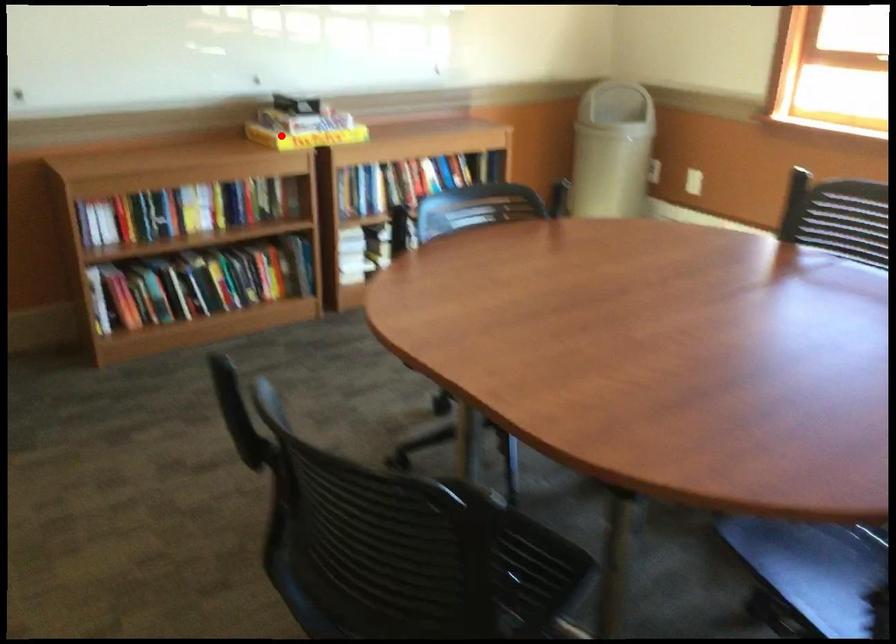
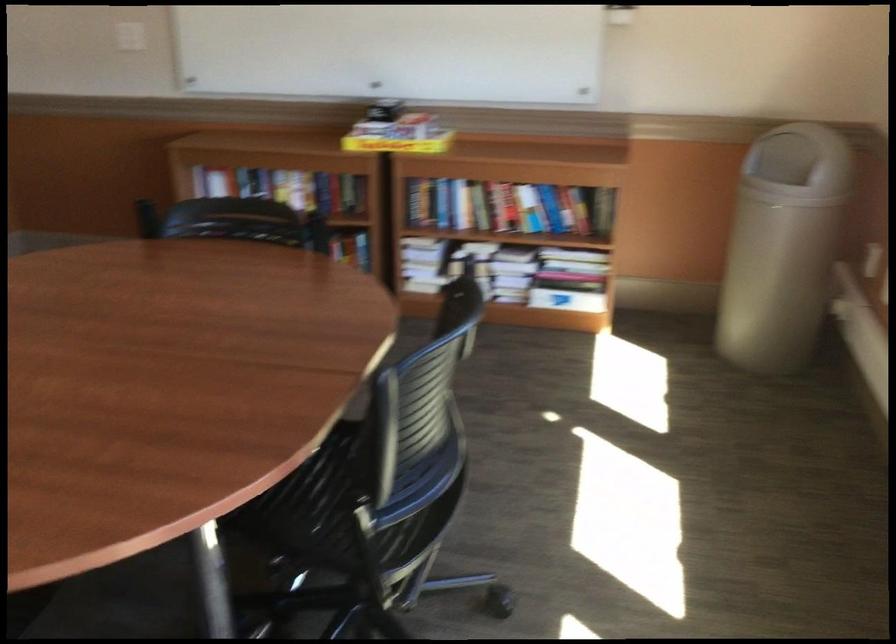
Find the pixel in the second image that matches the highlighted location in the first image.

(398, 144)